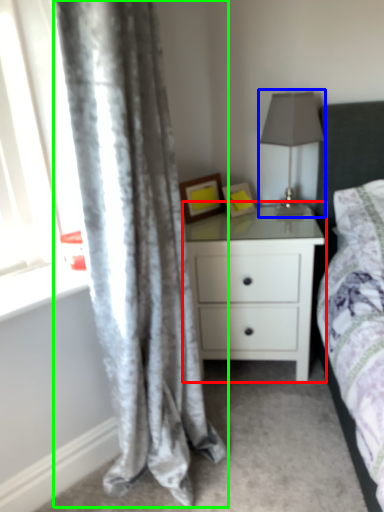
Question: Estimate the real-world distances between objects in this image. Which object is closer to nightstand (highlighted by a red box), table lamp (highlighted by a blue box) or curtain (highlighted by a green box)?

Choices:
 (A) table lamp
 (B) curtain

Answer: (A)